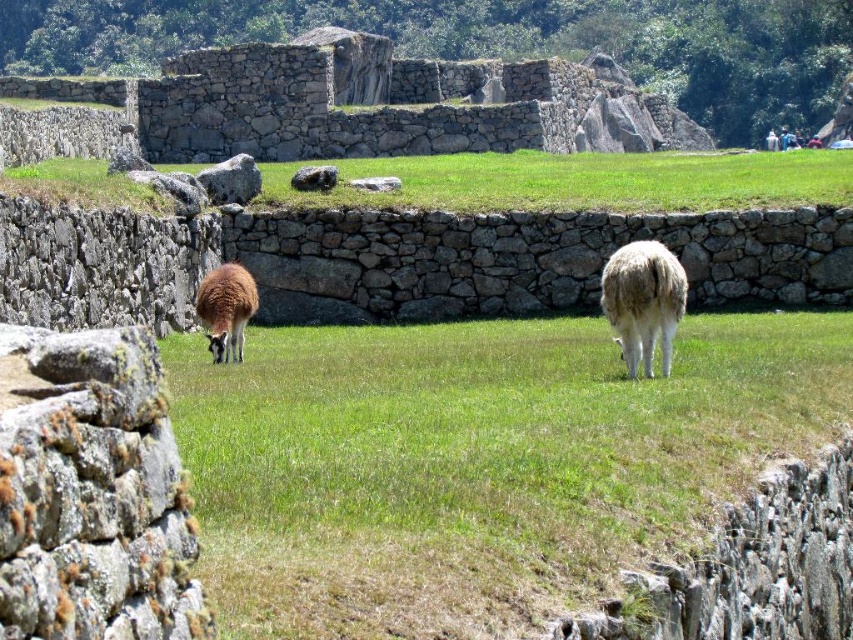
Between green grassy field at center and light blue fabric at upper right, which one has less height?

With less height is light blue fabric at upper right.

From the picture: Can you confirm if green grassy field at center is positioned below light blue fabric at upper right?

Correct, green grassy field at center is located below light blue fabric at upper right.

Does point (498, 184) come farther from viewer compared to point (776, 134)?

No, (498, 184) is closer to viewer.

You are a GUI agent. You are given a task and a screenshot of the screen. Output one action in this format:
    pyautogui.click(x=<x>, y=<y>)
    Task: Click on the green grassy field at center
    
    Given the screenshot: What is the action you would take?
    pyautogui.click(x=579, y=180)

Based on the photo, does green grassy field at center appear over brown woolly alpaca at left?

Yes, green grassy field at center is above brown woolly alpaca at left.

Between point (279, 188) and point (239, 323), which one is positioned in front?

Point (239, 323)

I want to click on green grassy field at center, so click(x=579, y=180).

Is fuzzy white llama at center taller than brown woolly alpaca at left?

Yes.

Can you confirm if fuzzy white llama at center is wider than brown woolly alpaca at left?

Correct, the width of fuzzy white llama at center exceeds that of brown woolly alpaca at left.

This screenshot has width=853, height=640. Describe the element at coordinates (479, 461) in the screenshot. I see `fuzzy white llama at center` at that location.

The width and height of the screenshot is (853, 640). In order to click on fuzzy white llama at center in this screenshot , I will do `click(479, 461)`.